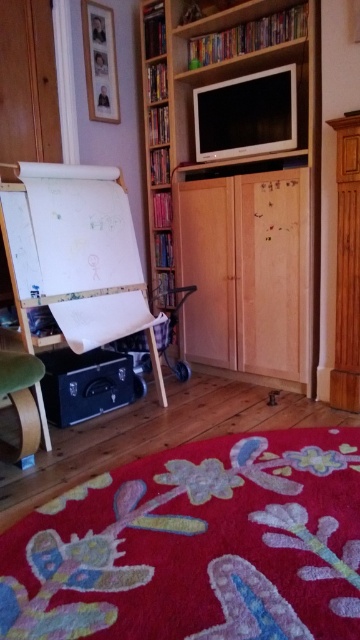
Question: Can you confirm if wooden bookcase at center is positioned to the left of wooden bookshelf at center?

Choices:
 (A) no
 (B) yes

Answer: (A)

Question: Which object is farther from the camera taking this photo?

Choices:
 (A) white matte easel at left
 (B) wooden bookcase at center
 (C) wooden bookshelf at center
 (D) green fabric chair at lower left

Answer: (C)

Question: From the image, what is the correct spatial relationship of white matte easel at left in relation to green fabric chair at lower left?

Choices:
 (A) above
 (B) below

Answer: (A)

Question: Considering the relative positions of white matte easel at left and wooden bookshelf at center in the image provided, where is white matte easel at left located with respect to wooden bookshelf at center?

Choices:
 (A) right
 (B) left

Answer: (B)

Question: Which point is closer to the camera?

Choices:
 (A) green fabric chair at lower left
 (B) white matte easel at left

Answer: (A)

Question: Which point is closer to the camera?

Choices:
 (A) white matte easel at left
 (B) wooden bookcase at center
 (C) wooden bookshelf at center
 (D) green fabric chair at lower left

Answer: (D)